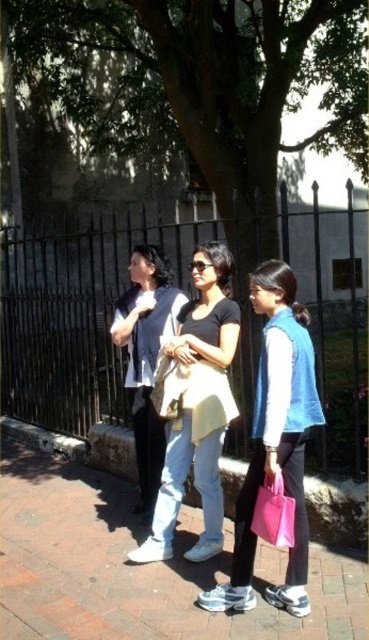
Question: Which object is positioned farthest from the pink fabric bag at lower center?

Choices:
 (A) brick pavement at center
 (B) matte yellow bag at center

Answer: (A)

Question: Is matte white shirt at center to the left of pink fabric bag at lower center from the viewer's perspective?

Choices:
 (A) no
 (B) yes

Answer: (B)

Question: Is green leafy tree at center positioned in front of matte yellow bag at center?

Choices:
 (A) no
 (B) yes

Answer: (A)

Question: Which of these objects is positioned closest to the matte yellow bag at center?

Choices:
 (A) pink fabric bag at lower center
 (B) matte white shirt at center

Answer: (B)

Question: Can you confirm if green leafy tree at center is positioned to the right of matte yellow shirt at center?

Choices:
 (A) yes
 (B) no

Answer: (A)

Question: Which object is closer to the camera taking this photo?

Choices:
 (A) pink fabric bag at lower center
 (B) matte yellow shirt at center

Answer: (A)